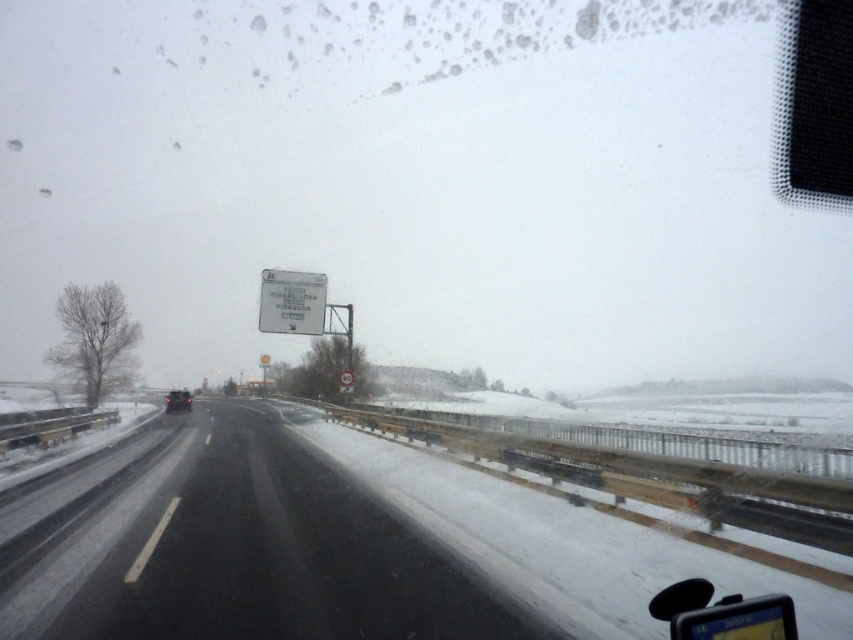
Question: From the image, what is the correct spatial relationship of black asphalt highway at center in relation to matte black car at center?

Choices:
 (A) left
 (B) right

Answer: (B)

Question: Can you confirm if white paper sign at upper center is positioned below matte black car at center?

Choices:
 (A) no
 (B) yes

Answer: (A)

Question: Does black asphalt highway at center appear over white paper sign at upper center?

Choices:
 (A) yes
 (B) no

Answer: (B)

Question: Which point appears farthest from the camera in this image?

Choices:
 (A) (97, 573)
 (B) (293, 301)
 (C) (169, 396)

Answer: (C)

Question: Which object is farther from the camera taking this photo?

Choices:
 (A) black asphalt highway at center
 (B) white paper sign at upper center
 (C) matte black car at center

Answer: (C)

Question: Among these points, which one is nearest to the camera?

Choices:
 (A) (184, 400)
 (B) (291, 470)

Answer: (B)